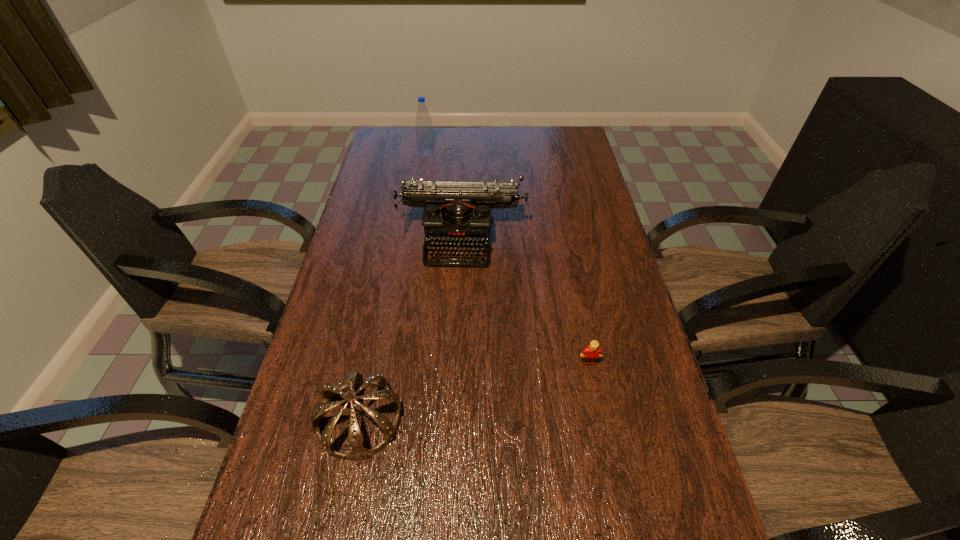
I want to click on the tallest object, so click(x=425, y=142).

This screenshot has width=960, height=540. I want to click on water bottle, so click(x=425, y=142).

Identify the location of the second tallest object. The image size is (960, 540). (456, 214).

Locate an element on the screen. typewriter is located at coordinates (456, 214).

Locate an element on the screen. the third tallest object is located at coordinates (330, 392).

In order to click on the nearest object in this screenshot , I will do `click(330, 392)`.

This screenshot has width=960, height=540. What are the coordinates of `the third farthest object` in the screenshot? It's located at (590, 354).

Image resolution: width=960 pixels, height=540 pixels. Find the location of `the shortest object`. the shortest object is located at coordinates (590, 354).

Where is `free space located 0.190m on the front of the tallest object`? free space located 0.190m on the front of the tallest object is located at coordinates (421, 186).

I want to click on vacant position located on the keyboard of the second tallest object, so click(459, 303).